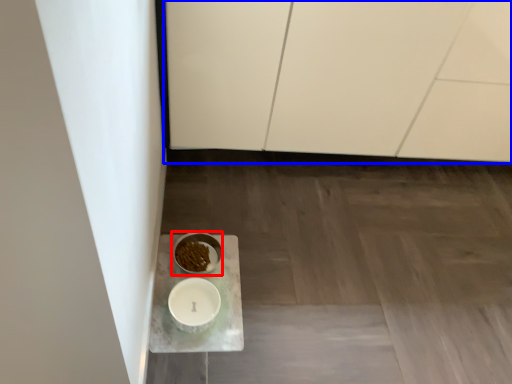
Question: Which of the following is the farthest to the observer, tableware (highlighted by a red box) or cabinetry (highlighted by a blue box)?

Choices:
 (A) tableware
 (B) cabinetry

Answer: (A)